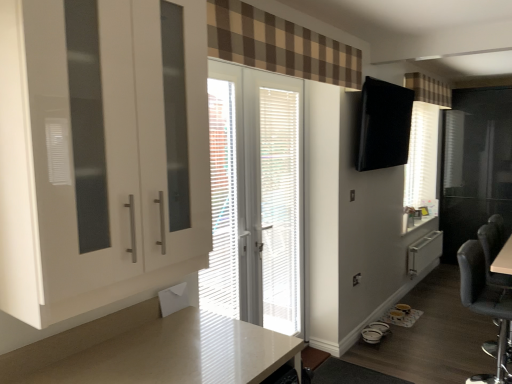
Question: Is brown checkered curtain at upper center, placed as the 1th curtain when sorted from front to back, at the right side of white glossy cabinet at left?

Choices:
 (A) no
 (B) yes

Answer: (B)

Question: Is white glossy cabinet at left completely or partially inside brown checkered curtain at upper center, placed as the 1th curtain when sorted from front to back?

Choices:
 (A) yes
 (B) no

Answer: (B)

Question: Can you confirm if brown checkered curtain at upper center, which is the 2th curtain in back-to-front order, is taller than white glossy cabinet at left?

Choices:
 (A) no
 (B) yes

Answer: (A)

Question: Does brown checkered curtain at upper center, placed as the 1th curtain when sorted from front to back, lie behind white glossy cabinet at left?

Choices:
 (A) yes
 (B) no

Answer: (A)

Question: Does brown checkered curtain at upper center, acting as the 2th curtain starting from the right, turn towards white glossy cabinet at left?

Choices:
 (A) no
 (B) yes

Answer: (A)

Question: From a real-world perspective, is white/textured blinds at center physically located above or below brown checkered curtain at upper center, arranged as the 1th curtain when ordered from the bottom?

Choices:
 (A) above
 (B) below

Answer: (B)

Question: In the image, is white/textured blinds at center positioned in front of or behind brown checkered curtain at upper center, which is counted as the first curtain, starting from the left?

Choices:
 (A) behind
 (B) front

Answer: (A)

Question: Considering the positions of point (289, 145) and point (327, 61), is point (289, 145) closer or farther from the camera than point (327, 61)?

Choices:
 (A) closer
 (B) farther

Answer: (B)

Question: Is white/textured blinds at center situated inside brown checkered curtain at upper center, which is the 2th curtain in back-to-front order, or outside?

Choices:
 (A) outside
 (B) inside

Answer: (A)

Question: Is white plastic radiator at lower right spatially inside brown checkered curtain at upper center, acting as the 2th curtain starting from the right, or outside of it?

Choices:
 (A) outside
 (B) inside

Answer: (A)

Question: Is white plastic radiator at lower right in front of or behind brown checkered curtain at upper center, which is counted as the first curtain, starting from the left, in the image?

Choices:
 (A) front
 (B) behind

Answer: (B)

Question: From a real-world perspective, is white plastic radiator at lower right physically located above or below brown checkered curtain at upper center, which is the 2th curtain in back-to-front order?

Choices:
 (A) below
 (B) above

Answer: (A)

Question: In terms of width, does white plastic radiator at lower right look wider or thinner when compared to brown checkered curtain at upper center, which is counted as the first curtain, starting from the left?

Choices:
 (A) wide
 (B) thin

Answer: (A)

Question: Visually, is brown checkered curtain at upper center, which is counted as the first curtain, starting from the left, positioned to the left or to the right of black fabric chair at lower right?

Choices:
 (A) right
 (B) left

Answer: (B)

Question: Considering their positions, is brown checkered curtain at upper center, arranged as the 1th curtain when ordered from the bottom, located in front of or behind black fabric chair at lower right?

Choices:
 (A) front
 (B) behind

Answer: (A)